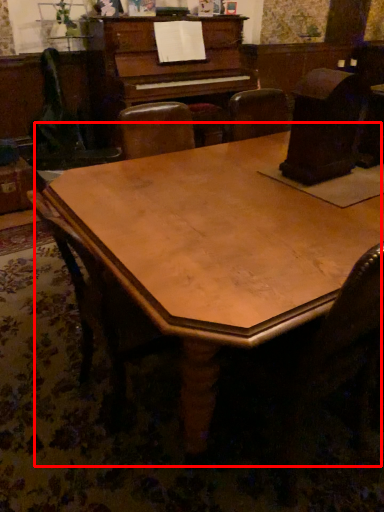
Question: From the image's perspective, considering the relative positions of table (annotated by the red box) and chair in the image provided, where is table (annotated by the red box) located with respect to the staircase?

Choices:
 (A) above
 (B) below

Answer: (A)